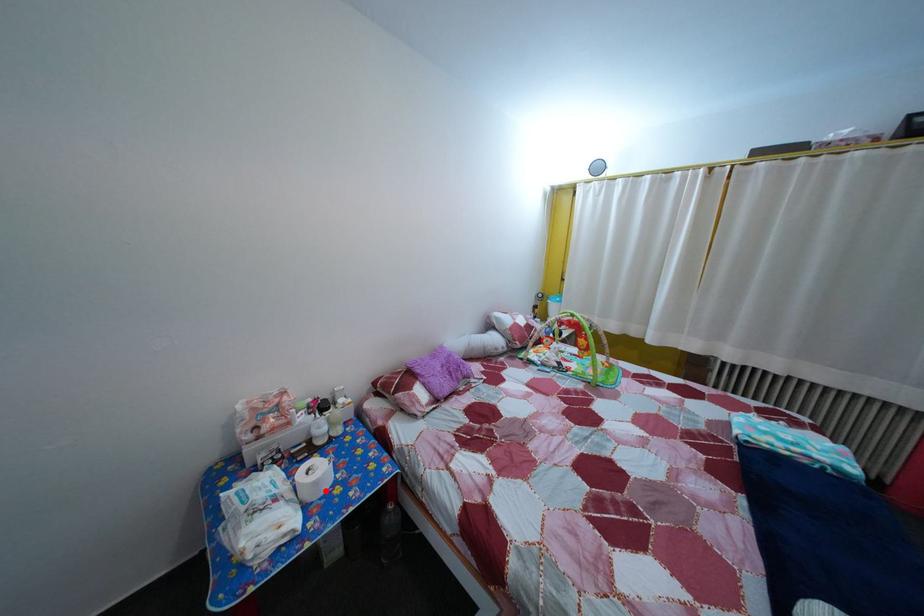
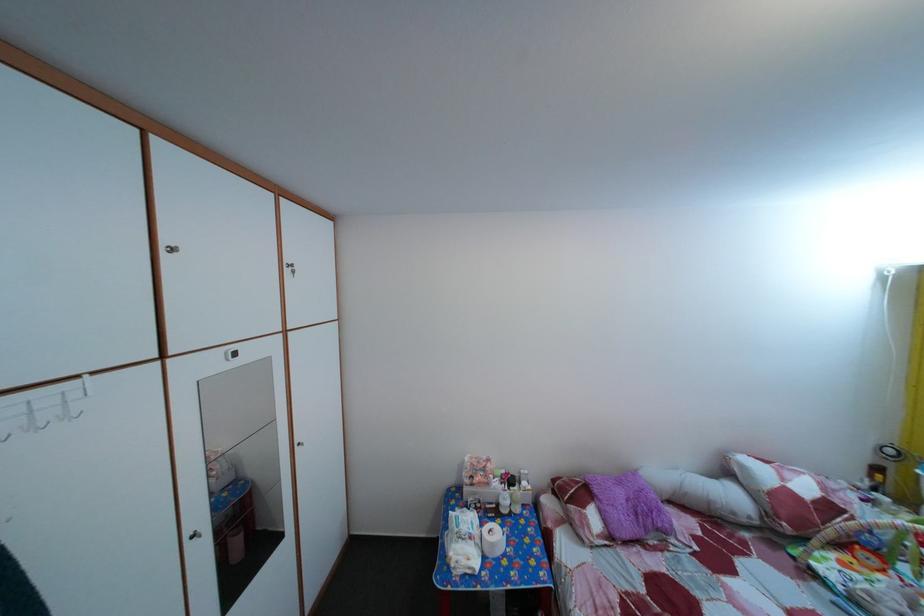
Locate, in the second image, the point that corresponds to the highlighted location in the first image.

(502, 553)